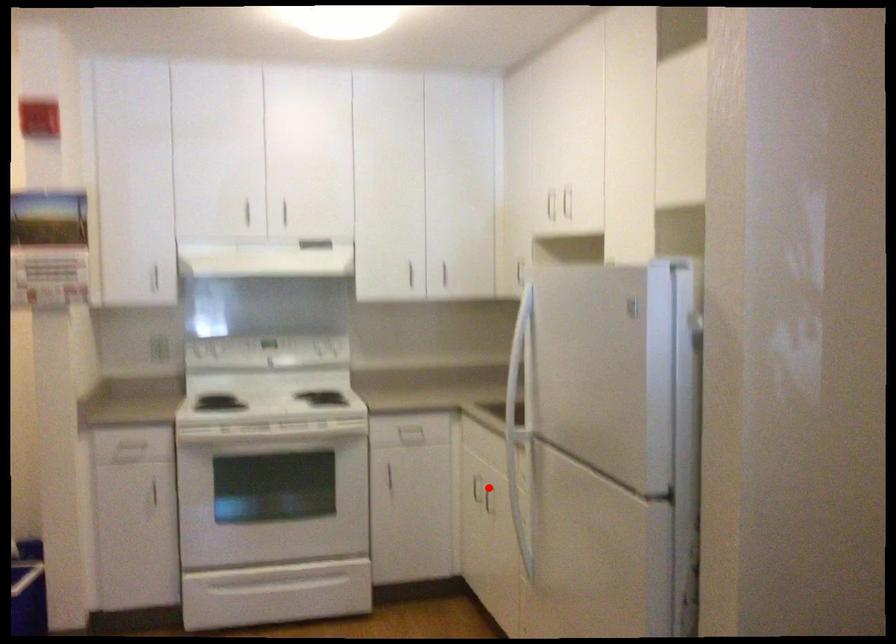
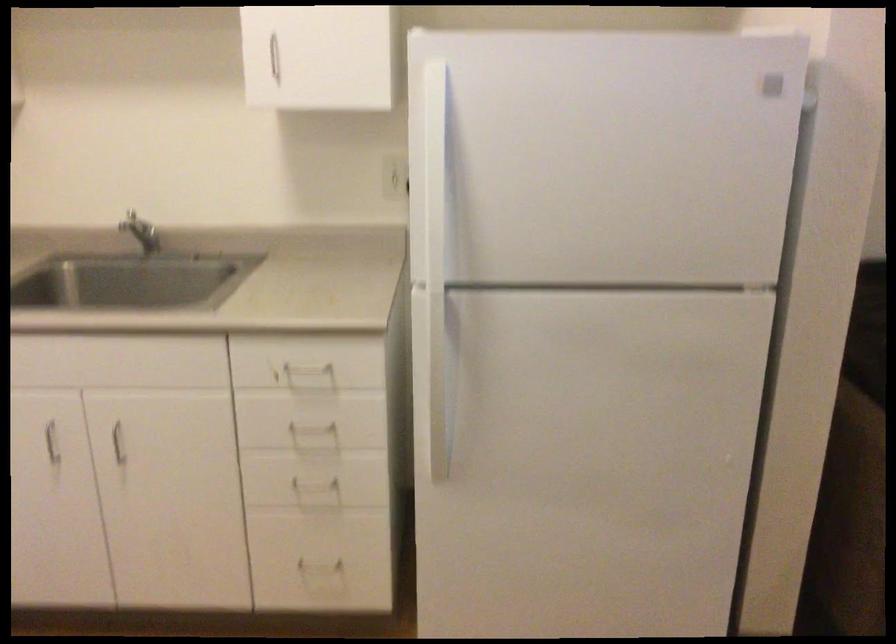
Question: I am providing you with two images of the same scene from different viewpoints. In image1, a red point is highlighted. Considering the same 3D point in image2, which of the following is correct?

Choices:
 (A) It is closer
 (B) It is farther

Answer: (A)